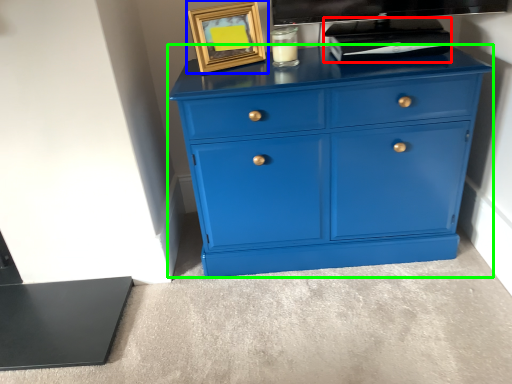
Question: Estimate the real-world distances between objects in this image. Which object is closer to appliance (highlighted by a red box), picture frame (highlighted by a blue box) or chest of drawers (highlighted by a green box)?

Choices:
 (A) picture frame
 (B) chest of drawers

Answer: (B)